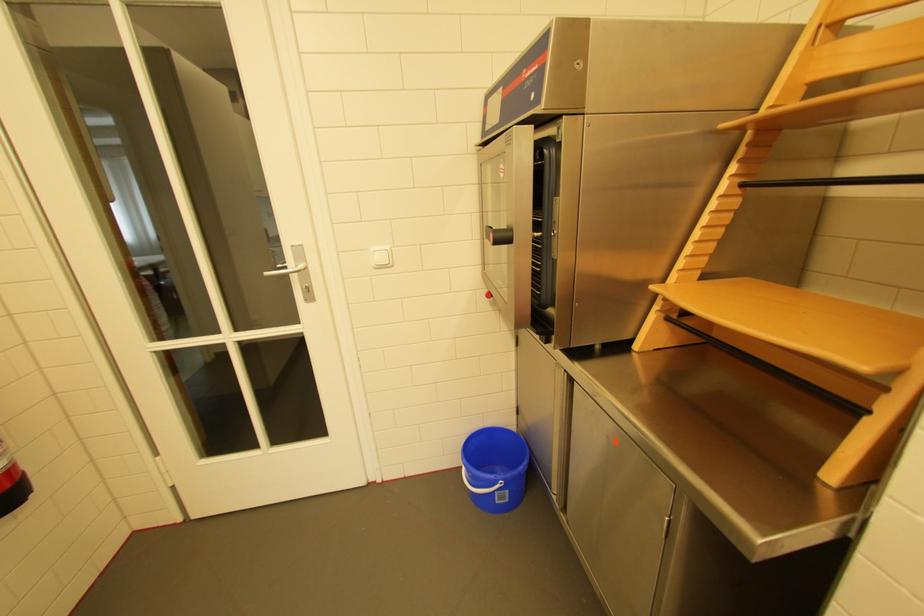
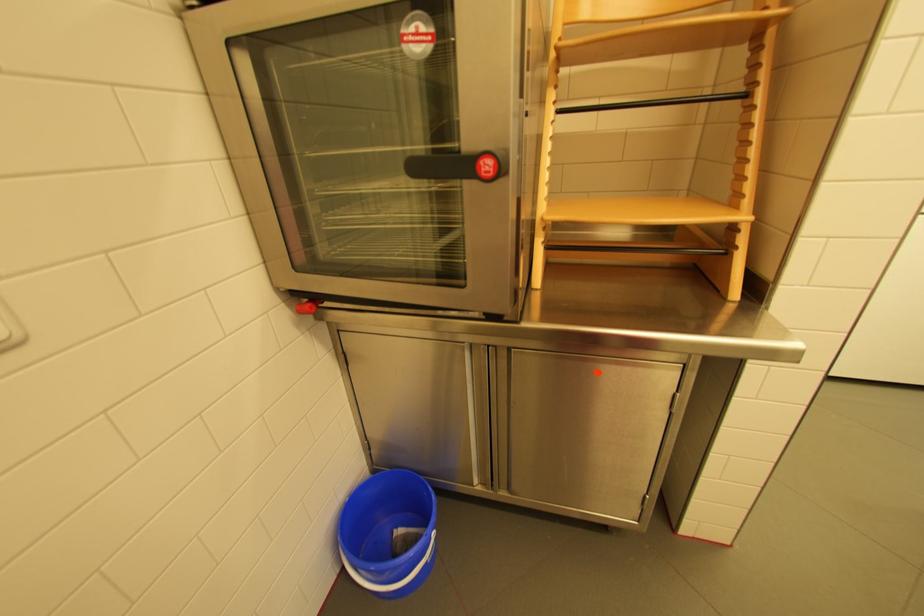
Question: The camera is either moving clockwise (left) or counter-clockwise (right) around the object. The first image is from the beginning of the video and the second image is from the end. Is the camera moving left or right when shooting the video?

Choices:
 (A) Left
 (B) Right

Answer: (A)